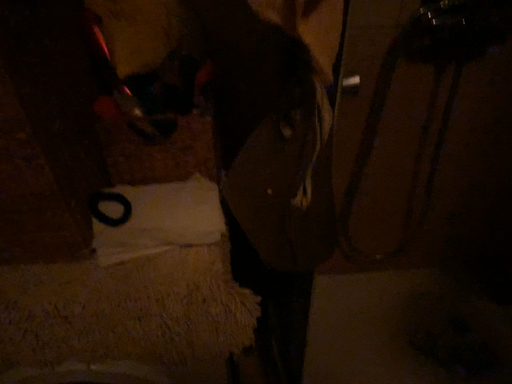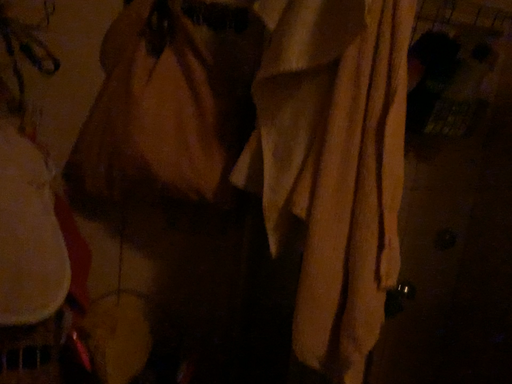
Question: Which way did the camera rotate in the video?

Choices:
 (A) rotated upward
 (B) rotated downward

Answer: (A)